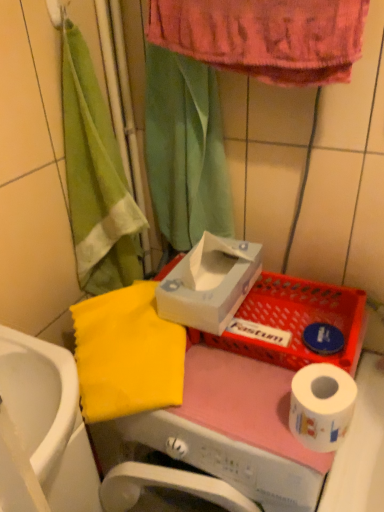
Where is `free point behind white paper at lower right`? free point behind white paper at lower right is located at coordinates (264, 364).